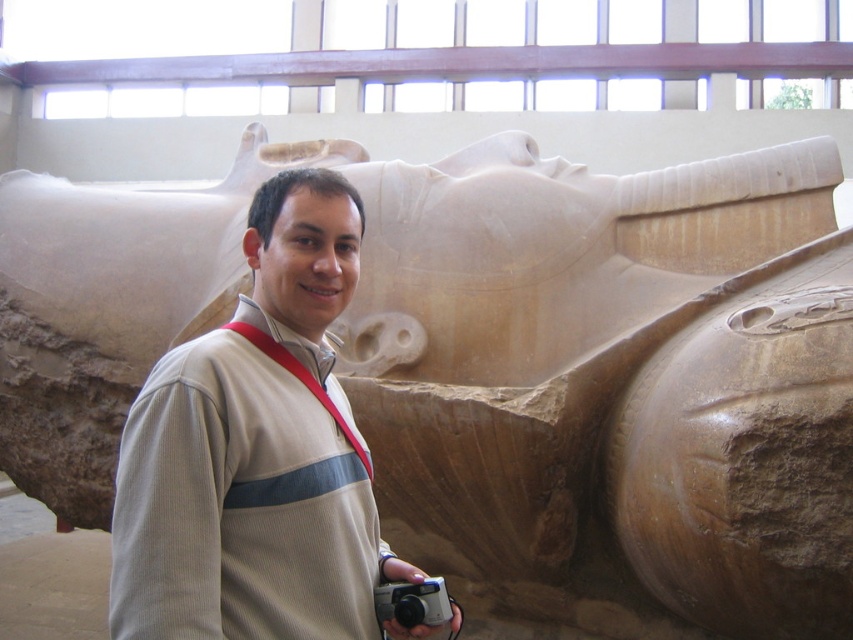
You are a photographer trying to capture the stone sculpture in the image. You have a beige corduroy sweater at center and a silver plastic camera at lower center. Which item should you use to adjust the lighting if you need a larger reflective surface?

The beige corduroy sweater at center is larger in size than the silver plastic camera at lower center, so you should use the beige corduroy sweater at center to adjust the lighting for a larger reflective surface.

You are a fashion designer looking at a photo of a person wearing a light colored jacket with a dark stripe across the chest and a red strap over their shoulder. You notice a point at coordinates (256, 452). Based on the image, what item of clothing is this point located on?

The point (256, 452) is located on the beige corduroy sweater at center.

You are standing at the point marked as point (329, 209) and want to take a photo of the stone sculpture. The camera you are using has a maximum focus range of 30 feet. Will you be able to focus on the sculpture from this point?

The distance of point (329, 209) from camera is 31.05 feet, which exceeds the camera maximum focus range of 30 feet. So you cannot focus on the sculpture from this point.